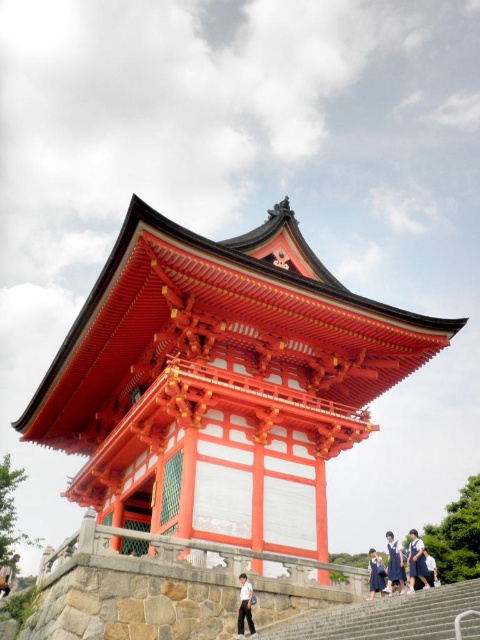
Question: Considering the real-world distances, which object is farthest from the white uniform pants at lower center?

Choices:
 (A) blue school uniform at lower center
 (B) gray stone stairs at lower center
 (C) shiny lacquered pagoda at center
 (D) white uniform at center

Answer: (C)

Question: Does shiny lacquered pagoda at center have a larger size compared to blue school uniform at lower center?

Choices:
 (A) no
 (B) yes

Answer: (A)

Question: Based on their relative distances, which object is nearer to the white cotton shirt at center?

Choices:
 (A) white uniform at center
 (B) shiny lacquered pagoda at center
 (C) white uniform pants at lower center
 (D) blue school uniform at lower center

Answer: (C)

Question: Which is farther from the shiny lacquered pagoda at center?

Choices:
 (A) white cotton shirt at center
 (B) blue school uniform at center
 (C) white uniform at center

Answer: (A)

Question: Can you confirm if shiny lacquered pagoda at center is smaller than white cotton shirt at center?

Choices:
 (A) no
 (B) yes

Answer: (A)

Question: Can you confirm if white uniform at center is smaller than white uniform pants at lower center?

Choices:
 (A) no
 (B) yes

Answer: (A)